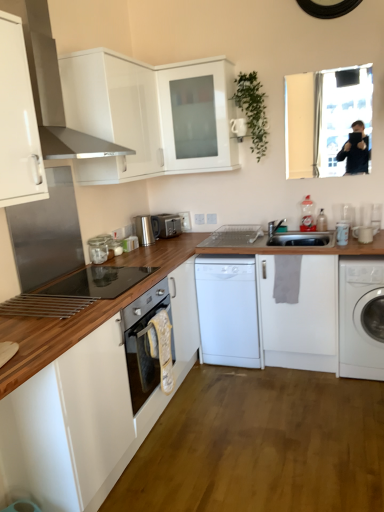
Locate an element on the screen. The image size is (384, 512). vacant area that is in front of white glossy mug at right, the 4th appliance when ordered from left to right is located at coordinates (367, 247).